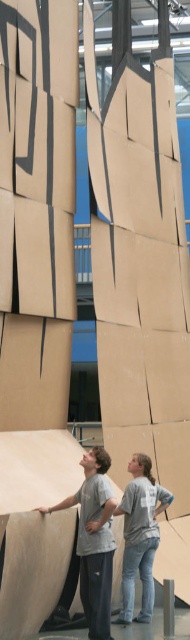
Is point (102, 554) farther from viewer compared to point (147, 588)?

No, (102, 554) is closer to viewer.

Which is behind, point (105, 605) or point (141, 538)?

The point (141, 538) is behind.

Where is `matte gray skateboard at lower center`? The width and height of the screenshot is (190, 640). matte gray skateboard at lower center is located at coordinates (x=94, y=540).